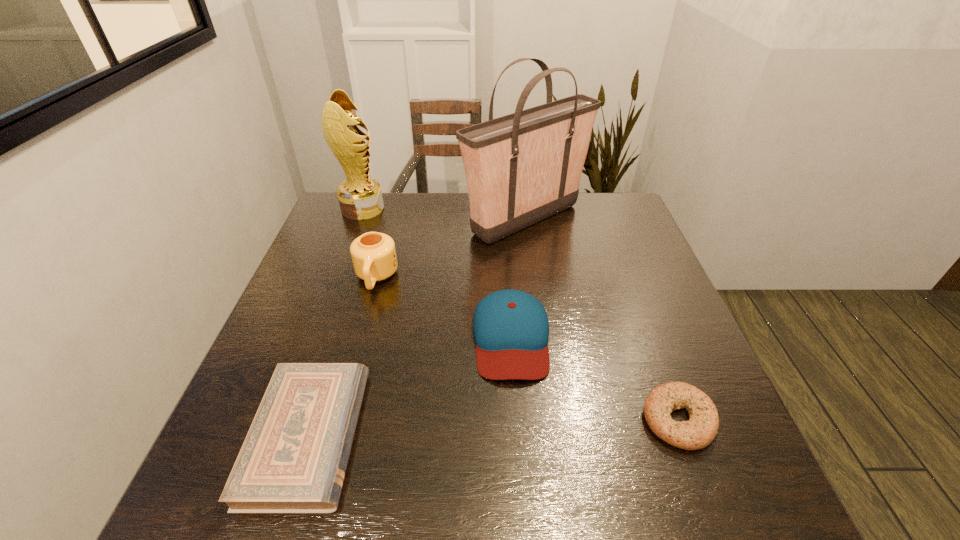
Locate an element on the screen. object that ranks as the third closest to the award is located at coordinates tap(511, 329).

Find the location of a particular element. This screenshot has width=960, height=540. free spot that satisfies the following two spatial constraints: 1. on the front-facing side of the bagel; 2. on the right side of the second tallest object is located at coordinates (284, 420).

Locate an element on the screen. The image size is (960, 540). vacant region that satisfies the following two spatial constraints: 1. on the front-facing side of the award; 2. on the left side of the tallest object is located at coordinates (359, 220).

I want to click on vacant space that satisfies the following two spatial constraints: 1. on the handle side of the bagel; 2. on the right side of the fourth shortest object, so click(338, 420).

What are the coordinates of `vacant space that satisfies the following two spatial constraints: 1. on the handle side of the fourth shortest object; 2. on the left side of the bagel` in the screenshot? It's located at (338, 420).

Find the location of `free location that satisfies the following two spatial constraints: 1. on the handle side of the third farthest object; 2. on the left side of the bagel`. free location that satisfies the following two spatial constraints: 1. on the handle side of the third farthest object; 2. on the left side of the bagel is located at coordinates (338, 420).

This screenshot has width=960, height=540. In order to click on free region that satisfies the following two spatial constraints: 1. on the front-facing side of the second tallest object; 2. on the back side of the bagel in this screenshot , I will do [x=284, y=420].